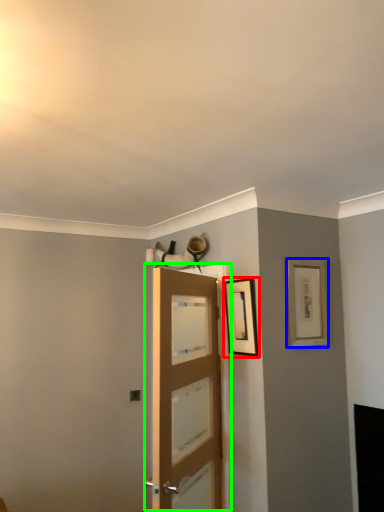
Question: Which object is the closest to the picture frame (highlighted by a red box)? Choose among these: picture frame (highlighted by a blue box) or door (highlighted by a green box).

Choices:
 (A) picture frame
 (B) door

Answer: (A)